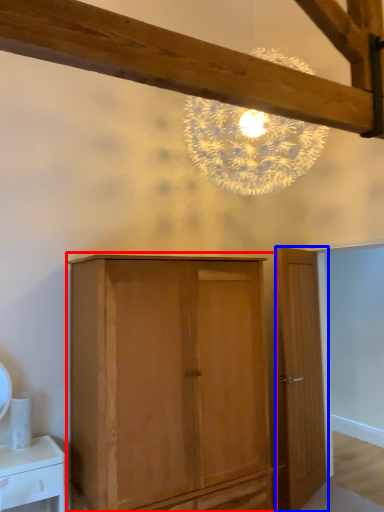
Question: Which point is closer to the camera, cupboard (highlighted by a red box) or door (highlighted by a blue box)?

Choices:
 (A) cupboard
 (B) door

Answer: (A)